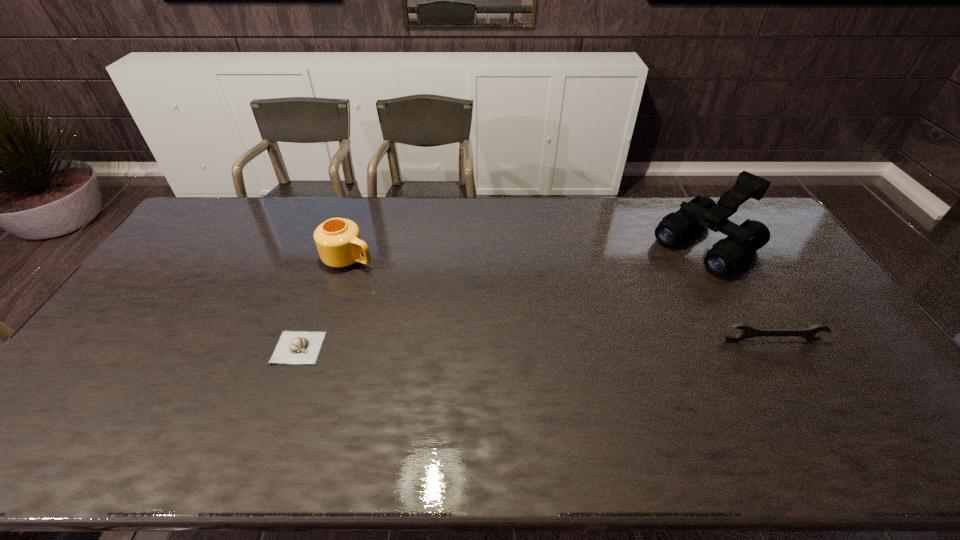
Where is `object that is the second closest to the shortest object`? object that is the second closest to the shortest object is located at coordinates (743, 240).

The height and width of the screenshot is (540, 960). Identify the location of object identified as the second closest to the garlic. (743, 240).

Where is `free location that satisfies the following two spatial constraints: 1. on the back side of the garlic; 2. on the left side of the mug`? This screenshot has width=960, height=540. free location that satisfies the following two spatial constraints: 1. on the back side of the garlic; 2. on the left side of the mug is located at coordinates (331, 258).

Identify the location of free space in the image that satisfies the following two spatial constraints: 1. on the back side of the mug; 2. on the left side of the garlic. tap(331, 258).